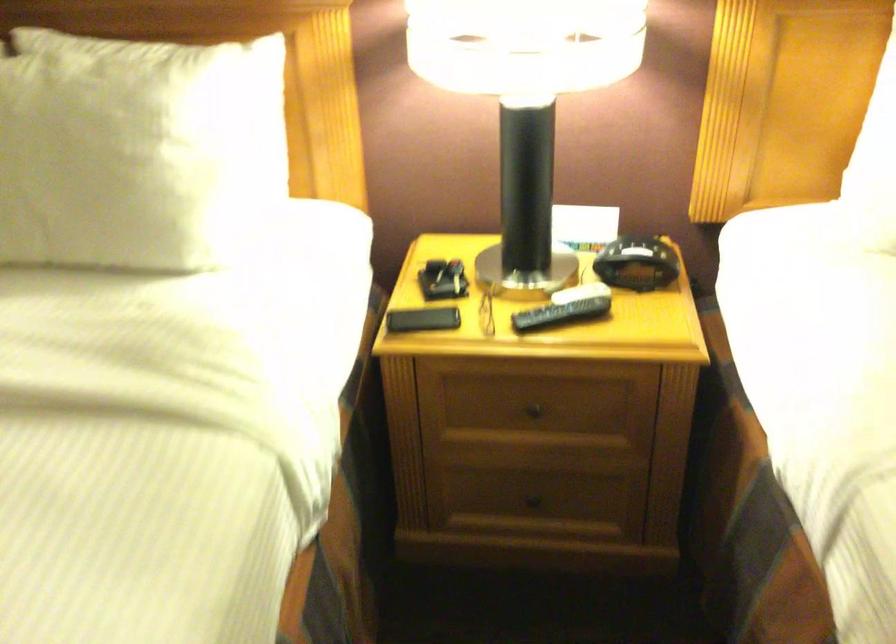
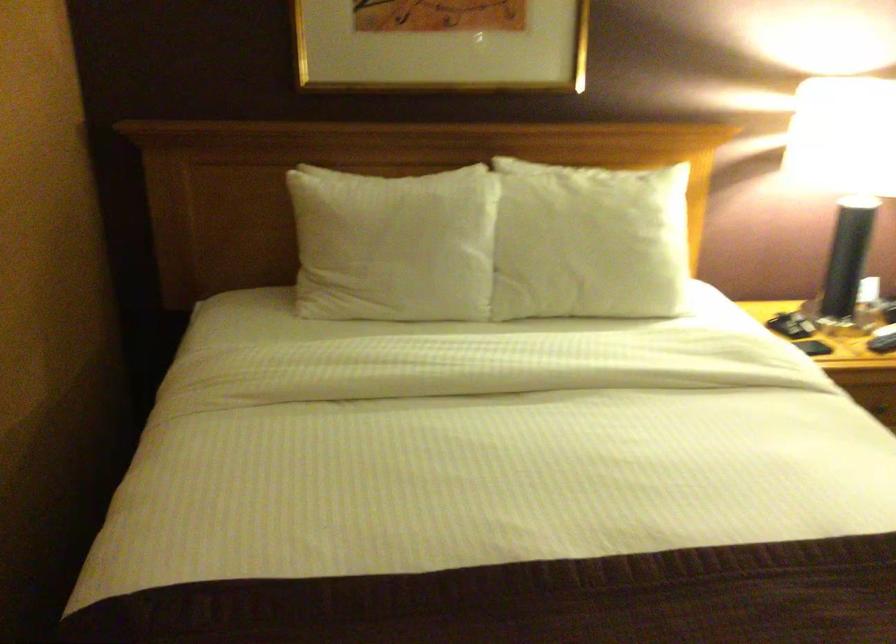
In the scene shown: What movement of the cameraman would produce the second image?

The cameraman moved toward left, backward.